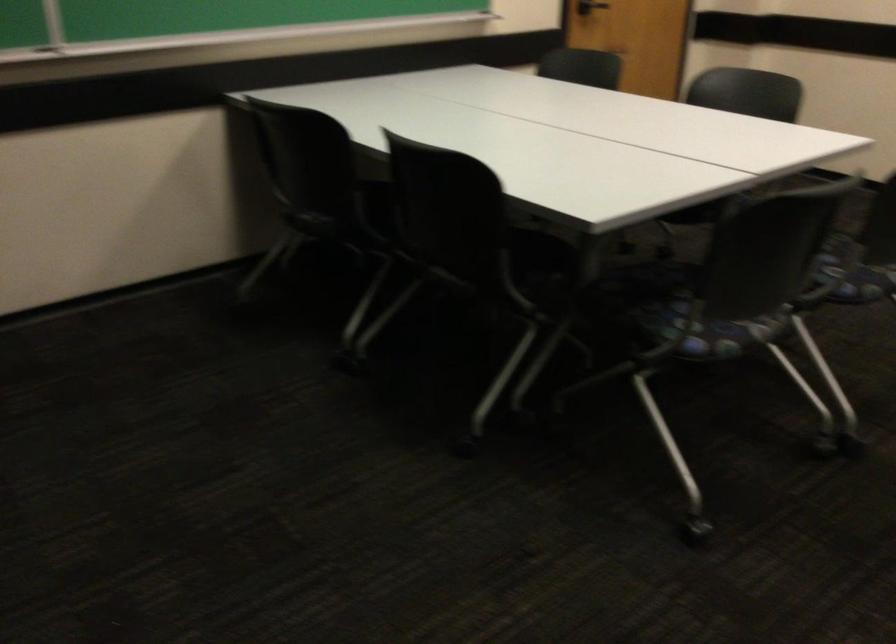
Image resolution: width=896 pixels, height=644 pixels. What do you see at coordinates (590, 6) in the screenshot?
I see `the black door handle` at bounding box center [590, 6].